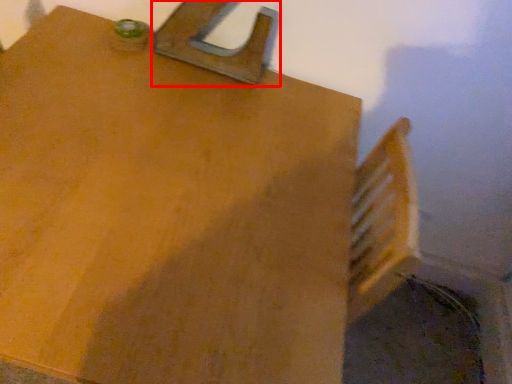
Question: Considering the relative positions of latch (annotated by the red box) and table in the image provided, where is latch (annotated by the red box) located with respect to the staircase?

Choices:
 (A) left
 (B) right

Answer: (B)